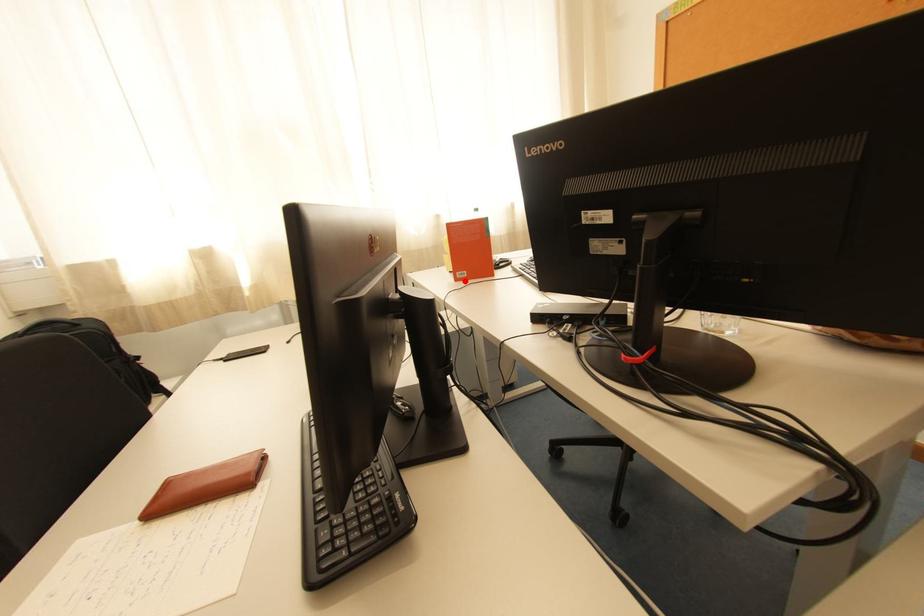
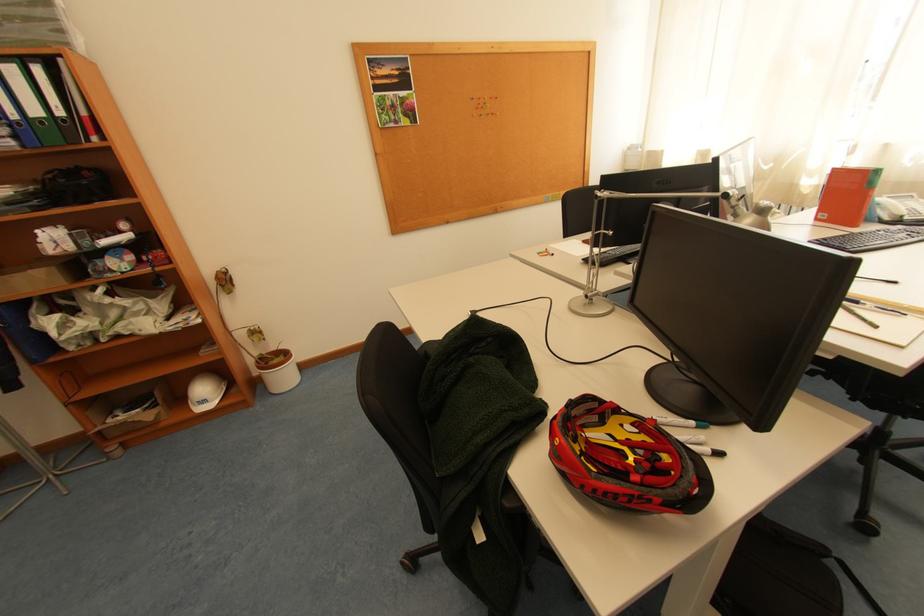
Where in the second image is the point corresponding to the highlighted location from the first image?

(824, 220)